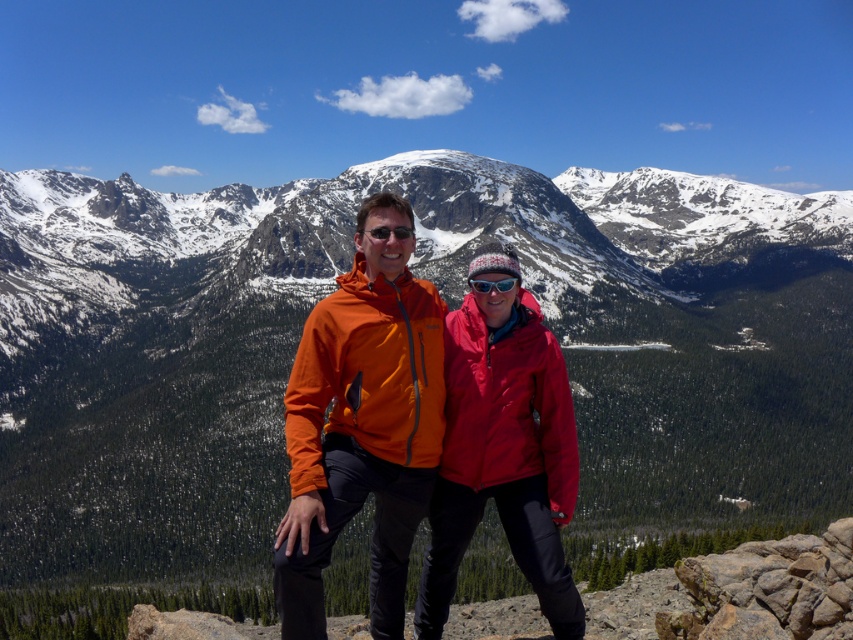
You are a photographer planning to take a portrait of the two people in the image. You want to ensure that the orange softshell jacket at center and the matte black goggles at center are both clearly visible in the frame. Based on their sizes, which object should you focus on to ensure both are in focus?

The orange softshell jacket at center has a greater height compared to matte black goggles at center. To ensure both are in focus, focus on the orange softshell jacket at center since it is larger and will require proper focus to capture details, while the smaller matte black goggles at center will likely remain in focus due to their smaller size.

You are a hiker planning to take a photo of the snowy granite mountain at center from the orange softshell jacket at center position. Given that your camera has a maximum focus range of 80 meters, will you be able to capture the mountain clearly?

The snowy granite mountain at center is 79.42 meters away from the orange softshell jacket at center. Since the distance is within the camera maximum focus range of 80 meters, you can capture the mountain clearly.

What is the exact coordinate of the snowy granite mountain at center?

The snowy granite mountain at center is located at point [448,307].